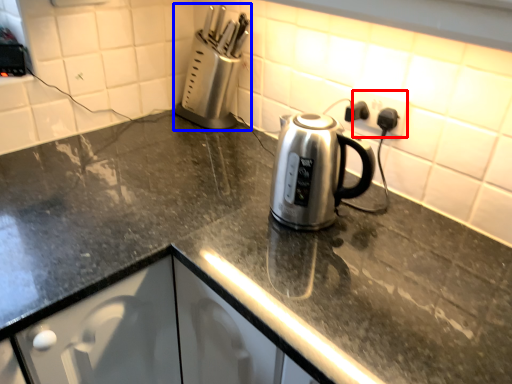
Question: Which point is further to the camera, electric outlet (highlighted by a red box) or appliance (highlighted by a blue box)?

Choices:
 (A) electric outlet
 (B) appliance

Answer: (B)